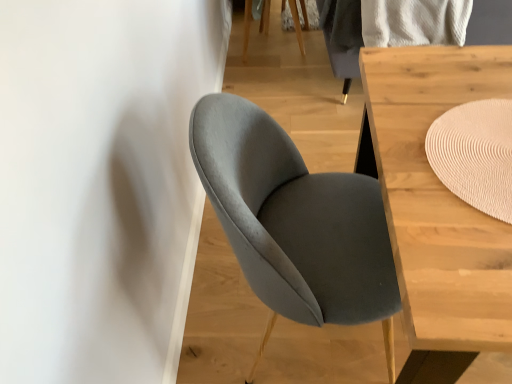
The height and width of the screenshot is (384, 512). What are the coordinates of `beige woven mat at upper right` in the screenshot? It's located at (475, 154).

Identify the location of light wood table at center. (436, 206).

Is there a large distance between light wood table at center and suede gray chair at center?

That's not correct — light wood table at center is a little close to suede gray chair at center.

Considering the sizes of light wood table at center and suede gray chair at center in the image, is light wood table at center bigger or smaller than suede gray chair at center?

In the image, light wood table at center appears to be larger than suede gray chair at center.

I want to click on table below the suede gray chair at center (from a real-world perspective), so click(x=436, y=206).

Consider the image. Is light wood table at center spatially inside suede gray chair at center, or outside of it?

light wood table at center is outside suede gray chair at center.

Is point (490, 350) closer to viewer compared to point (508, 106)?

Yes.

How different are the orientations of light wood table at center and beige woven mat at upper right in degrees?

The facing directions of light wood table at center and beige woven mat at upper right are 0.872 degrees apart.

Is light wood table at center facing away from beige woven mat at upper right?

No, light wood table at center is not facing away from beige woven mat at upper right.

The image size is (512, 384). I want to click on table on the right of the beige woven mat at upper right, so click(x=436, y=206).

How far apart are beige woven mat at upper right and light wood table at center?

A distance of 4.02 inches exists between beige woven mat at upper right and light wood table at center.

Does point (489, 147) appear closer or farther from the camera than point (433, 321)?

Point (489, 147).

Considering the relative sizes of beige woven mat at upper right and light wood table at center in the image provided, is beige woven mat at upper right thinner than light wood table at center?

Correct, the width of beige woven mat at upper right is less than that of light wood table at center.

Which is correct: suede gray chair at center is inside light wood table at center, or outside of it?

The correct answer is: outside.

Which of these two, suede gray chair at center or light wood table at center, stands shorter?

With less height is light wood table at center.

From the image's perspective, would you say suede gray chair at center is positioned over light wood table at center?

Yes, from the image's perspective, suede gray chair at center is on top of light wood table at center.

Is suede gray chair at center facing away from light wood table at center?

Correct, suede gray chair at center is looking away from light wood table at center.

Considering the sizes of objects beige woven mat at upper right and suede gray chair at center in the image provided, who is wider, beige woven mat at upper right or suede gray chair at center?

suede gray chair at center is wider.

From the image's perspective, which object appears higher, beige woven mat at upper right or suede gray chair at center?

From the image's view, beige woven mat at upper right is above.

Which object is more forward, beige woven mat at upper right or suede gray chair at center?

suede gray chair at center is closer to the camera.

Consider the image. Could you tell me if suede gray chair at center is turned towards beige woven mat at upper right?

Yes, suede gray chair at center is aimed at beige woven mat at upper right.

From the image's perspective, is suede gray chair at center above or below beige woven mat at upper right?

suede gray chair at center is situated lower than beige woven mat at upper right in the image.

In the image, is suede gray chair at center positioned in front of or behind beige woven mat at upper right?

suede gray chair at center is positioned closer to the viewer than beige woven mat at upper right.

Which object is thinner, suede gray chair at center or beige woven mat at upper right?

beige woven mat at upper right.

The image size is (512, 384). There is a light wood table at center. Find the location of `chair above it (from a real-world perspective)`. chair above it (from a real-world perspective) is located at coordinates (295, 222).

You are a GUI agent. You are given a task and a screenshot of the screen. Output one action in this format:
    pyautogui.click(x=<x>, y=<y>)
    Task: Click on the table on the right of beige woven mat at upper right
    This screenshot has width=512, height=384.
    Given the screenshot: What is the action you would take?
    pyautogui.click(x=436, y=206)

Considering their positions, is light wood table at center positioned closer to beige woven mat at upper right than suede gray chair at center?

light wood table at center.

From the image, which object appears to be nearer to suede gray chair at center, light wood table at center or beige woven mat at upper right?

Among the two, light wood table at center is located nearer to suede gray chair at center.

Based on their spatial positions, is beige woven mat at upper right or light wood table at center closer to suede gray chair at center?

The object closer to suede gray chair at center is light wood table at center.

Which object lies nearer to the anchor point light wood table at center, beige woven mat at upper right or suede gray chair at center?

The object closer to light wood table at center is beige woven mat at upper right.

Based on the photo, considering their positions, is suede gray chair at center positioned further to light wood table at center than beige woven mat at upper right?

suede gray chair at center is positioned further to the anchor light wood table at center.

Looking at the image, which one is located closer to beige woven mat at upper right, suede gray chair at center or light wood table at center?

Among the two, light wood table at center is located nearer to beige woven mat at upper right.

You are a GUI agent. You are given a task and a screenshot of the screen. Output one action in this format:
    pyautogui.click(x=<x>, y=<y>)
    Task: Click on the mat between suede gray chair at center and light wood table at center from left to right
    The image size is (512, 384).
    Given the screenshot: What is the action you would take?
    pyautogui.click(x=475, y=154)